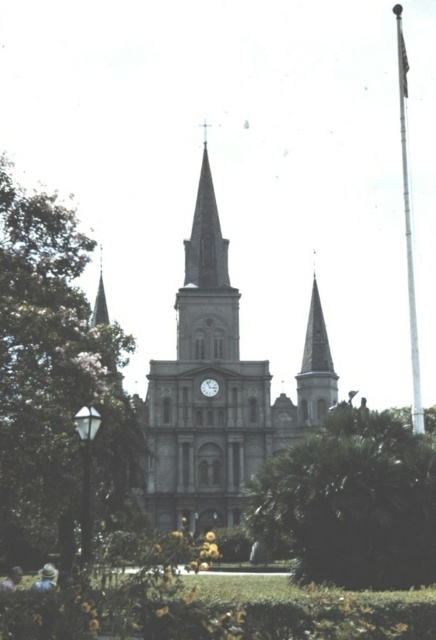
Is brown stone church at center thinner than green leafy tree at center?

No, brown stone church at center is not thinner than green leafy tree at center.

Who is more distant from viewer, (176, 474) or (389, 516)?

Point (176, 474)

In order to click on brown stone church at center in this screenshot , I will do `click(221, 392)`.

Does green leafy tree at left have a smaller size compared to metallic gray clock at center?

Actually, green leafy tree at left might be larger than metallic gray clock at center.

Which is below, green leafy tree at left or metallic gray clock at center?

Positioned lower is metallic gray clock at center.

I want to click on green leafy tree at left, so click(54, 381).

This screenshot has height=640, width=436. I want to click on green leafy tree at left, so click(54, 381).

Is green leafy tree at left shorter than green leafy tree at center?

Incorrect, green leafy tree at left's height does not fall short of green leafy tree at center's.

Looking at this image, who is more distant from viewer, (57, 326) or (429, 480)?

Positioned behind is point (429, 480).

I want to click on green leafy tree at left, so click(54, 381).

Identify the location of green leafy tree at left. The height and width of the screenshot is (640, 436). (54, 381).